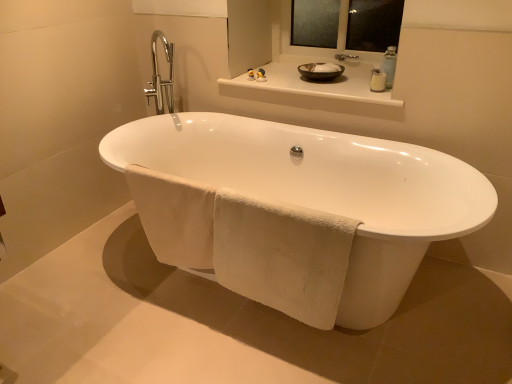
Question: From a real-world perspective, does white soft towel at lower center, the 1th bath towel from the left, sit lower than white ceramic bathtub at center?

Choices:
 (A) yes
 (B) no

Answer: (B)

Question: Would you consider white soft towel at lower center, which appears as the second bath towel when viewed from the right, to be distant from white ceramic bathtub at center?

Choices:
 (A) no
 (B) yes

Answer: (A)

Question: Is white soft towel at lower center, the 1th bath towel from the left, smaller than white ceramic bathtub at center?

Choices:
 (A) no
 (B) yes

Answer: (B)

Question: From the image's perspective, is white soft towel at lower center, which appears as the second bath towel when viewed from the right, on top of white ceramic bathtub at center?

Choices:
 (A) yes
 (B) no

Answer: (B)

Question: Is white ceramic bathtub at center surrounded by white soft towel at lower center, the 1th bath towel from the left?

Choices:
 (A) yes
 (B) no

Answer: (B)

Question: Is transparent glass mirror at upper center taller or shorter than white ceramic bathtub at center?

Choices:
 (A) short
 (B) tall

Answer: (A)

Question: From the image's perspective, is transparent glass mirror at upper center positioned above or below white ceramic bathtub at center?

Choices:
 (A) below
 (B) above

Answer: (B)

Question: From a real-world perspective, relative to white ceramic bathtub at center, is transparent glass mirror at upper center vertically above or below?

Choices:
 (A) above
 (B) below

Answer: (A)

Question: Looking at the image, does transparent glass mirror at upper center seem bigger or smaller compared to white ceramic bathtub at center?

Choices:
 (A) big
 (B) small

Answer: (B)

Question: Visually, is white glossy counter top at upper center positioned to the left or to the right of clear plastic soap dispenser at upper right?

Choices:
 (A) left
 (B) right

Answer: (A)

Question: Looking at their shapes, would you say white glossy counter top at upper center is wider or thinner than clear plastic soap dispenser at upper right?

Choices:
 (A) thin
 (B) wide

Answer: (B)

Question: From a real-world perspective, is white glossy counter top at upper center above or below clear plastic soap dispenser at upper right?

Choices:
 (A) above
 (B) below

Answer: (B)

Question: Is white glossy counter top at upper center situated inside clear plastic soap dispenser at upper right or outside?

Choices:
 (A) inside
 (B) outside

Answer: (B)

Question: Is matte rubber duck at upper center bigger or smaller than white glossy counter top at upper center?

Choices:
 (A) big
 (B) small

Answer: (B)

Question: From the image's perspective, relative to white glossy counter top at upper center, is matte rubber duck at upper center above or below?

Choices:
 (A) below
 (B) above

Answer: (B)